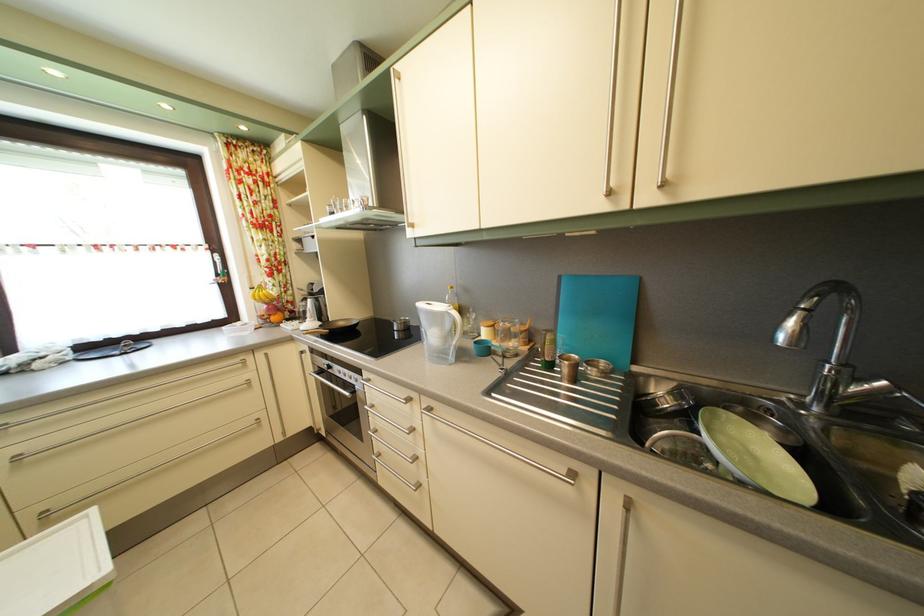
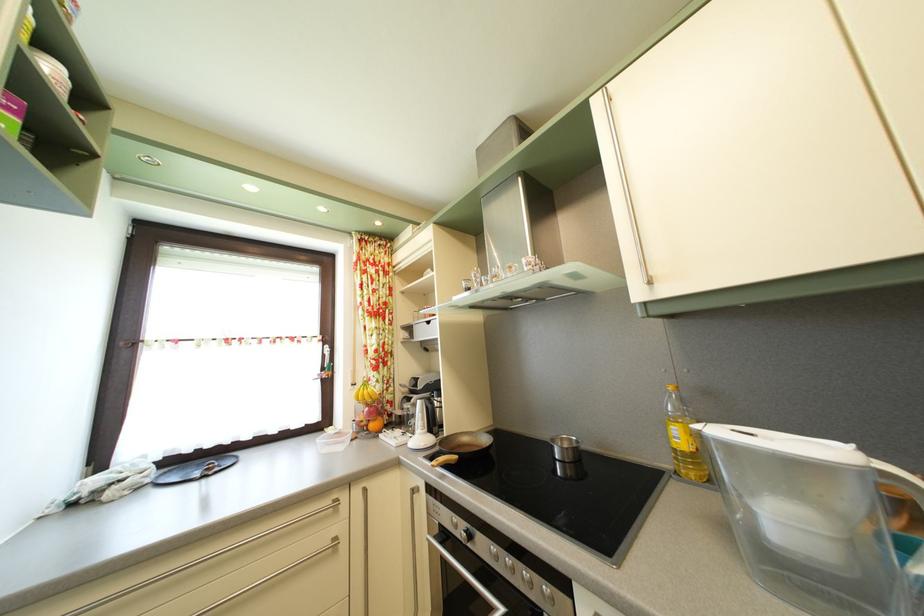
Where in the second image is the point corresponding to the point at 313,307 from the first image?

(417, 407)